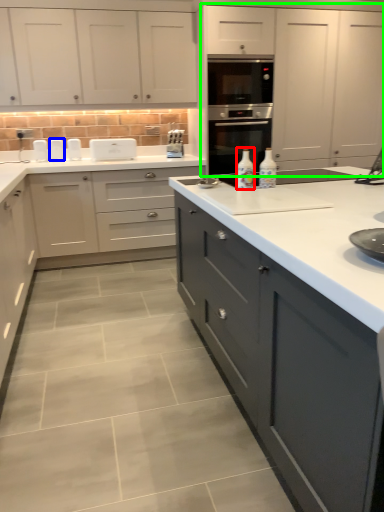
Question: Which is farther away from bottle (highlighted by a red box)? appliance (highlighted by a blue box) or cabinetry (highlighted by a green box)?

Choices:
 (A) appliance
 (B) cabinetry

Answer: (A)